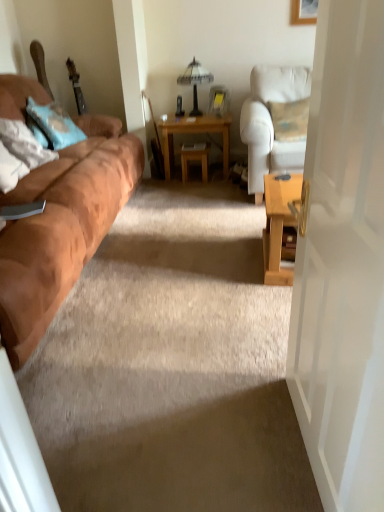
Locate an element on the screen. Image resolution: width=384 pixels, height=512 pixels. vacant area that is in front of light brown wooden table at center is located at coordinates (200, 188).